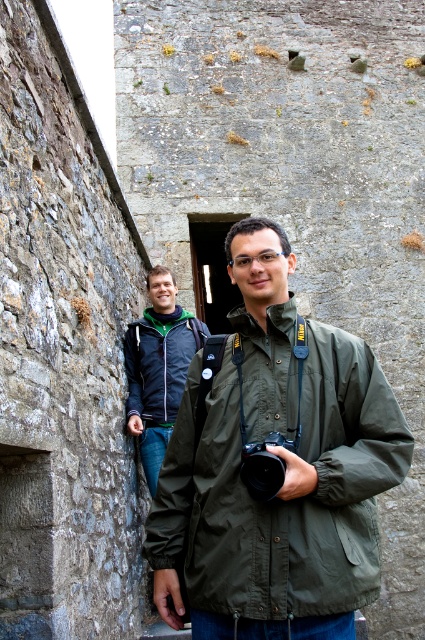
You are standing in front of an old stone wall and see two people wearing jackets. The olive green fabric jacket at center and the dark blue jacket at center. Which jacket is closer to you?

The olive green fabric jacket at center is closer to the viewer than the dark blue jacket at center.

You are a tailor measuring jackets for alterations. You have two jackets in front of you on a table, the olive green fabric jacket at center and the dark blue jacket at center. Which one is taller?

The olive green fabric jacket at center is taller than the dark blue jacket at center according to the description.

You are a photographer trying to focus on the point at coordinates (280, 499) in the image. Based on the scene description, what object or part of the scene is this point likely located on?

The point at coordinates (280, 499) is on the olive green fabric jacket at center.